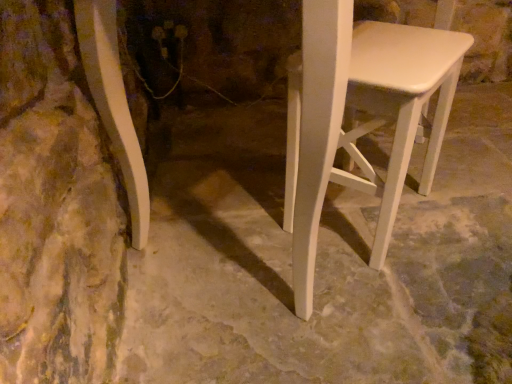
Measure the distance between white matte concrete at center and camera.

white matte concrete at center and camera are 78.12 centimeters apart from each other.

Measure the distance between point (488, 269) and camera.

Point (488, 269) is 99.70 centimeters away from camera.

Image resolution: width=512 pixels, height=384 pixels. I want to click on white matte concrete at center, so click(x=317, y=260).

The image size is (512, 384). Describe the element at coordinates (317, 260) in the screenshot. I see `white matte concrete at center` at that location.

This screenshot has height=384, width=512. What do you see at coordinates (364, 124) in the screenshot? I see `white matte stool at right` at bounding box center [364, 124].

Locate an element on the screen. The image size is (512, 384). white matte stool at right is located at coordinates (364, 124).

Identify the location of white matte concrete at center. (317, 260).

Which is more to the left, white matte concrete at center or white matte stool at right?

From the viewer's perspective, white matte stool at right appears more on the left side.

Is white matte concrete at center behind white matte stool at right?

That is False.

Is point (261, 168) closer to viewer compared to point (398, 166)?

No, it is not.

From the image's perspective, relative to white matte stool at right, is white matte concrete at center above or below?

Clearly, from the image's perspective, white matte concrete at center is below white matte stool at right.

From a real-world perspective, which object rests below the other?

white matte concrete at center, from a real-world perspective.

Considering the relative sizes of white matte concrete at center and white matte stool at right in the image provided, is white matte concrete at center thinner than white matte stool at right?

Incorrect, the width of white matte concrete at center is not less than that of white matte stool at right.

Considering the relative sizes of white matte concrete at center and white matte stool at right in the image provided, is white matte concrete at center shorter than white matte stool at right?

Indeed, white matte concrete at center has a lesser height compared to white matte stool at right.

Considering the sizes of objects white matte concrete at center and white matte stool at right in the image provided, who is smaller, white matte concrete at center or white matte stool at right?

Smaller between the two is white matte stool at right.

Consider the image. Is white matte concrete at center surrounding white matte stool at right?

No, white matte stool at right is not a part of white matte concrete at center.

Is the surface of white matte concrete at center in direct contact with white matte stool at right?

No, white matte concrete at center is not with white matte stool at right.

Is white matte concrete at center oriented towards white matte stool at right?

No.

How different are the orientations of white matte concrete at center and white matte stool at right in degrees?

The facing directions of white matte concrete at center and white matte stool at right are 41.6 degrees apart.

The image size is (512, 384). I want to click on stool above the white matte concrete at center (from the image's perspective), so click(364, 124).

Which is more to the right, white matte stool at right or white matte concrete at center?

From the viewer's perspective, white matte concrete at center appears more on the right side.

Is white matte stool at right in front of or behind white matte concrete at center in the image?

white matte stool at right is behind white matte concrete at center.

Is point (399, 120) positioned in front of point (446, 228)?

Yes, it is in front of point (446, 228).

From the image's perspective, which one is positioned higher, white matte stool at right or white matte concrete at center?

white matte stool at right is shown above in the image.

From a real-world perspective, between white matte stool at right and white matte concrete at center, who is vertically higher?

white matte stool at right.

Considering the relative sizes of white matte stool at right and white matte concrete at center in the image provided, is white matte stool at right thinner than white matte concrete at center?

Yes.

Considering the sizes of objects white matte stool at right and white matte concrete at center in the image provided, who is taller, white matte stool at right or white matte concrete at center?

With more height is white matte stool at right.

Considering the relative sizes of white matte stool at right and white matte concrete at center in the image provided, is white matte stool at right smaller than white matte concrete at center?

Yes, white matte stool at right is smaller than white matte concrete at center.

Which is correct: white matte stool at right is inside white matte concrete at center, or outside of it?

white matte stool at right lies outside white matte concrete at center.

Does white matte stool at right touch white matte concrete at center?

No, white matte stool at right is not touching white matte concrete at center.

Is white matte stool at right looking in the opposite direction of white matte concrete at center?

white matte stool at right is not turned away from white matte concrete at center.

Consider the image. How many degrees apart are the facing directions of white matte stool at right and white matte concrete at center?

They differ by 41.6 degrees in their facing directions.

How far apart are white matte stool at right and white matte concrete at center?

white matte stool at right and white matte concrete at center are 10.04 inches apart from each other.

You are a GUI agent. You are given a task and a screenshot of the screen. Output one action in this format:
    pyautogui.click(x=<x>, y=<y>)
    Task: Click on the stool that appears above the white matte concrete at center (from the image's perspective)
    The image size is (512, 384).
    Given the screenshot: What is the action you would take?
    coord(364,124)

At what (x,y) coordinates should I click in order to perform the action: click on concrete located in front of the white matte stool at right. Please return your answer as a coordinate pair (x, y). This screenshot has height=384, width=512. Looking at the image, I should click on (317, 260).

Identify the location of stool behind the white matte concrete at center. The height and width of the screenshot is (384, 512). (364, 124).